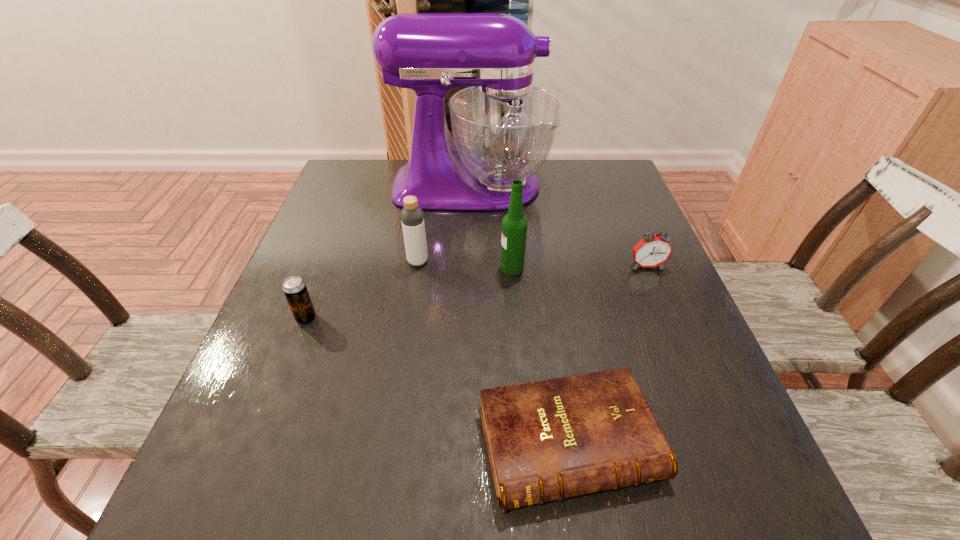
Locate an element on the screen. alarm clock that is positioned at the right edge is located at coordinates (651, 251).

Where is `hardback book that is at the right edge`? This screenshot has height=540, width=960. hardback book that is at the right edge is located at coordinates (551, 439).

This screenshot has height=540, width=960. I want to click on object at the near right corner, so click(551, 439).

Where is `vacant area at the left edge`? This screenshot has height=540, width=960. vacant area at the left edge is located at coordinates (239, 458).

The image size is (960, 540). I want to click on free spot at the right edge of the desktop, so click(610, 211).

In the image, there is a desktop. Identify the location of vacant space at the far left corner. (335, 185).

Identify the location of vacant area at the near right corner. (673, 525).

The width and height of the screenshot is (960, 540). In order to click on vacant point located between the shortest object and the farthest object in this screenshot , I will do `click(520, 315)`.

What are the coordinates of `free space between the beer bottle and the nearest object` in the screenshot? It's located at (540, 355).

Locate an element on the screen. This screenshot has height=540, width=960. free space between the alarm clock and the nearest object is located at coordinates (608, 355).